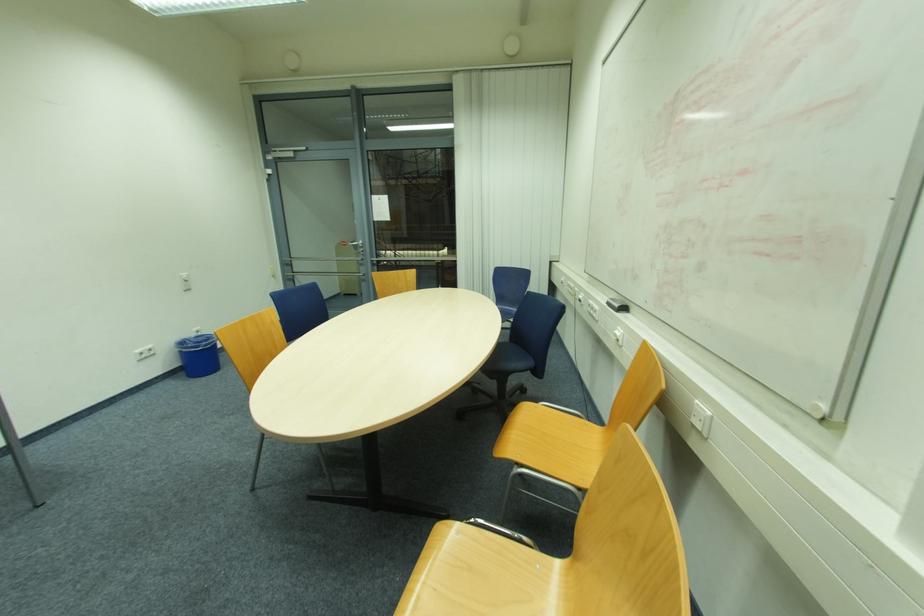
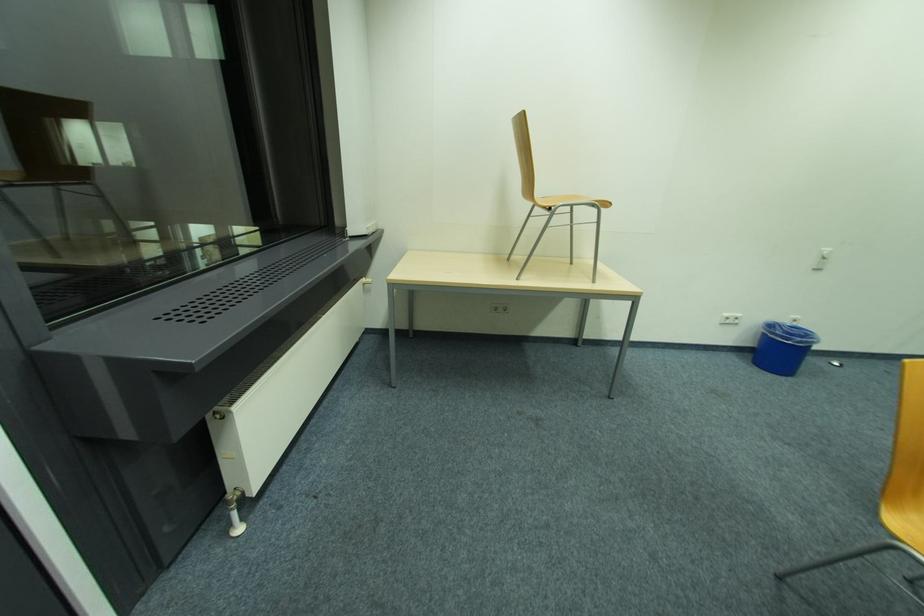
Where in the second image is the point corresponding to pixel 187 339 from the first image?

(779, 323)